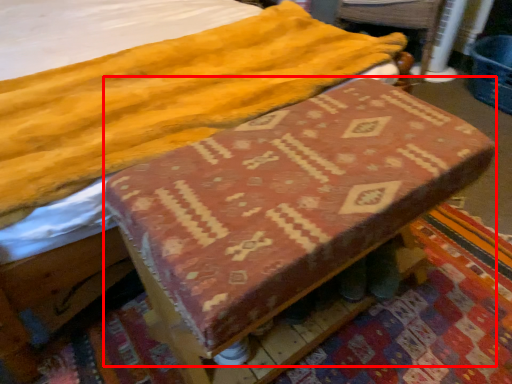
Question: In this image, where is changing table (annotated by the red box) located relative to swivel chair?

Choices:
 (A) right
 (B) left

Answer: (B)